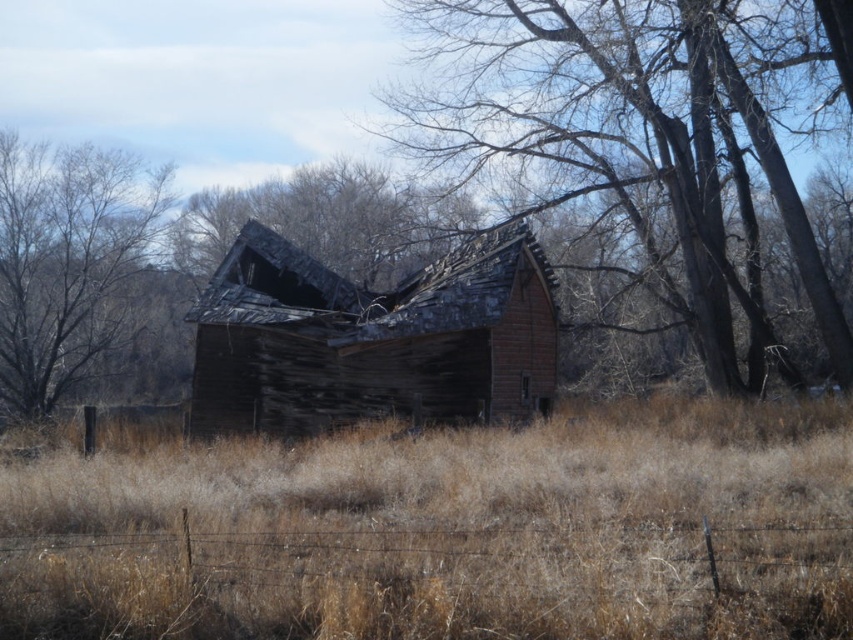
Question: Estimate the real-world distances between objects in this image. Which object is closer to the weathered wood barn at center?

Choices:
 (A) brown dry grass at center
 (B) weathered wood roof at center

Answer: (A)

Question: Considering the relative positions of brown dry grass at center and weathered wood barn at center in the image provided, where is brown dry grass at center located with respect to weathered wood barn at center?

Choices:
 (A) above
 (B) below

Answer: (B)

Question: Which object appears closest to the camera in this image?

Choices:
 (A) brown dry grass at center
 (B) smooth bark tree at center
 (C) weathered wood barn at center
 (D) brown rough bark tree at upper left

Answer: (A)

Question: Is brown dry grass at center positioned in front of weathered wood barn at center?

Choices:
 (A) yes
 (B) no

Answer: (A)

Question: Is smooth bark tree at center closer to camera compared to weathered wood roof at center?

Choices:
 (A) yes
 (B) no

Answer: (A)

Question: Estimate the real-world distances between objects in this image. Which object is closer to the weathered wood barn at center?

Choices:
 (A) smooth bark tree at center
 (B) brown rough bark tree at upper left

Answer: (A)